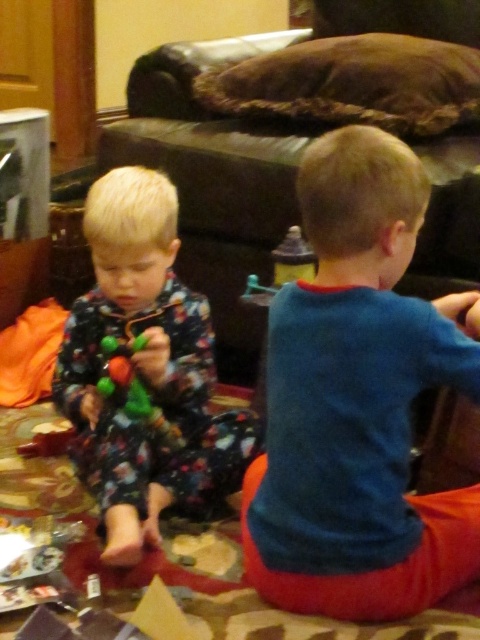
You are a photographer trying to capture a photo of both the blue cotton shirt at center and the floral pajamas at left. Based on their positions, which one should you focus on first to ensure they are both in the frame?

The blue cotton shirt at center is located below the floral pajamas at left, so you should focus on the floral pajamas at left first to ensure both are in the frame.

Looking at this image, you are a parent trying to pack a bag for your child. You have a bag that can only fit items up to 20 cm in width. You see the blue cotton shirt at center and the shiny plastic toy at left. Which item should you choose to ensure it fits in the bag?

The shiny plastic toy at left is narrower than the blue cotton shirt at center, so you should choose the shiny plastic toy at left to ensure it fits in the bag.